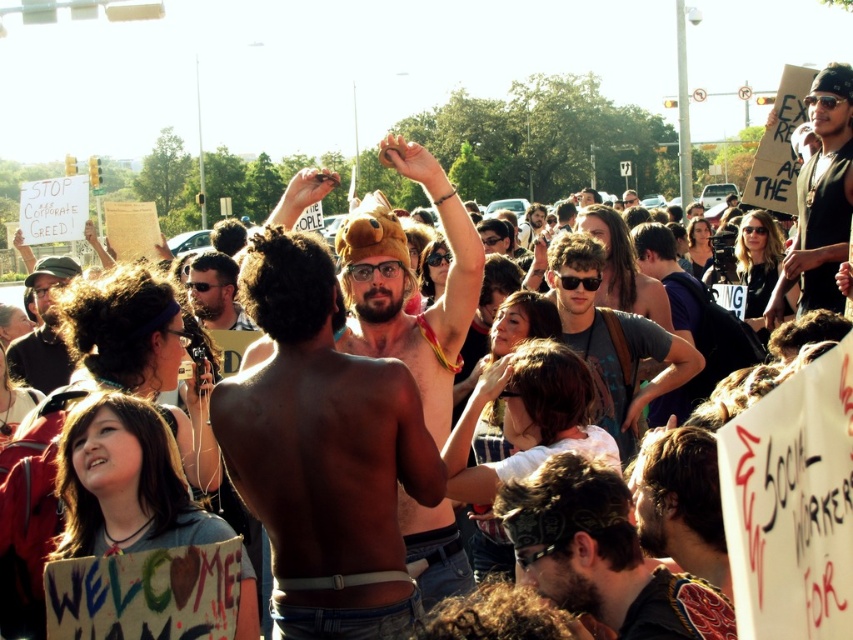
You are a photographer at the protest scene. You want to capture a photo that includes both the dark brown leather jacket at center and the matte black shirt at upper right. Which object will appear smaller in the final photo?

The dark brown leather jacket at center will appear smaller in the photo because it occupies less space than the matte black shirt at upper right.

You are a photographer at the protest scene. You need to capture a photo where both the dark brown leather jacket at center and the matte black shirt at upper right are visible. Based on their sizes, which object would appear smaller in the photo?

The dark brown leather jacket at center would appear smaller in the photo because it has a lesser width compared to the matte black shirt at upper right.

From the picture: You are a photographer at the protest scene. You want to capture a photo that includes both the shiny metallic tank top at center and the dark brown leather jacket at center. Which clothing item should you focus on to ensure both are fully visible in the frame?

The shiny metallic tank top at center has a larger width than the dark brown leather jacket at center, so focusing on the tank top will ensure both items are fully visible in the frame.